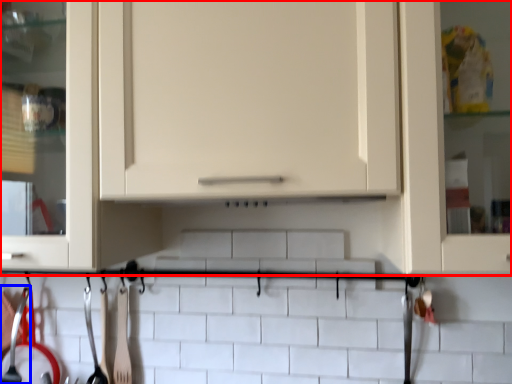
Question: Which of the following is the closest to the observer, cabinetry (highlighted by a red box) or silverware (highlighted by a blue box)?

Choices:
 (A) cabinetry
 (B) silverware

Answer: (A)